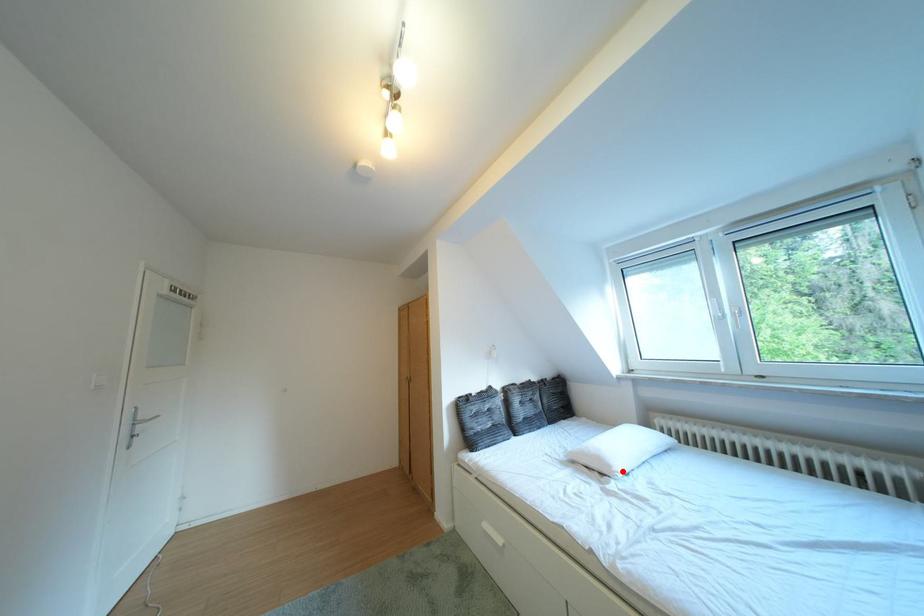
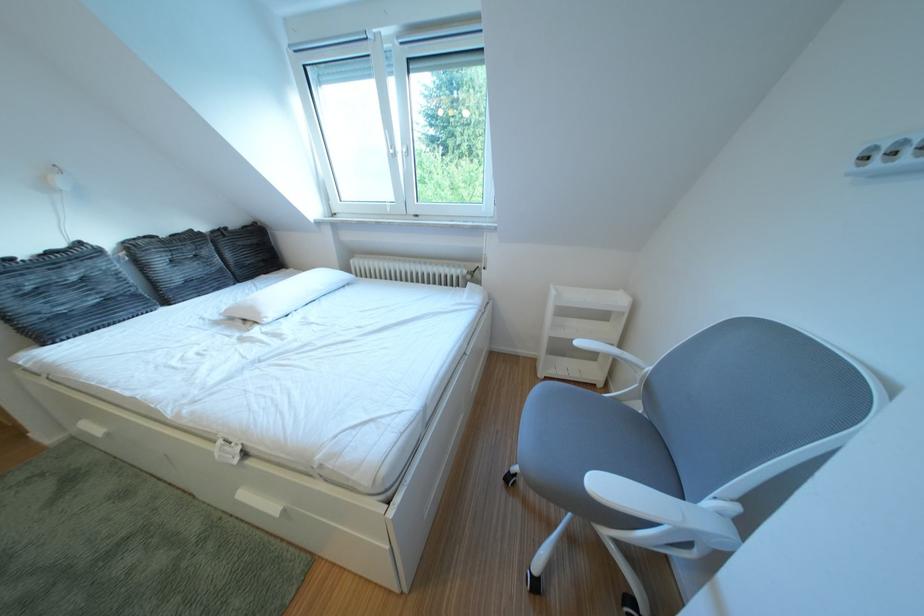
Locate, in the second image, the point that corresponds to the highlighted location in the first image.

(273, 318)